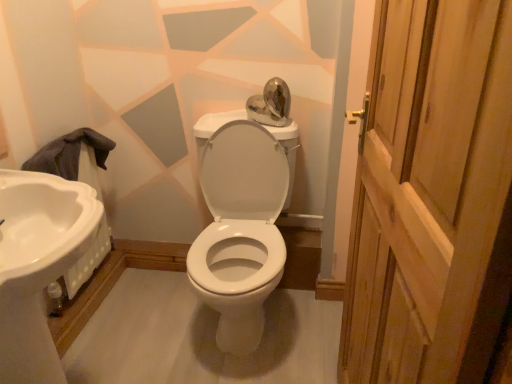
Question: Does point (12, 213) appear closer or farther from the camera than point (240, 183)?

Choices:
 (A) farther
 (B) closer

Answer: (B)

Question: In the image, is white glossy sink at left positioned in front of or behind white glossy porcelain at center?

Choices:
 (A) front
 (B) behind

Answer: (A)

Question: Which object is positioned closest to the white glossy sink at left?

Choices:
 (A) white glossy porcelain at center
 (B) wooden door at right

Answer: (A)

Question: Estimate the real-world distances between objects in this image. Which object is farther from the wooden door at right?

Choices:
 (A) white glossy sink at left
 (B) white glossy porcelain at center

Answer: (A)